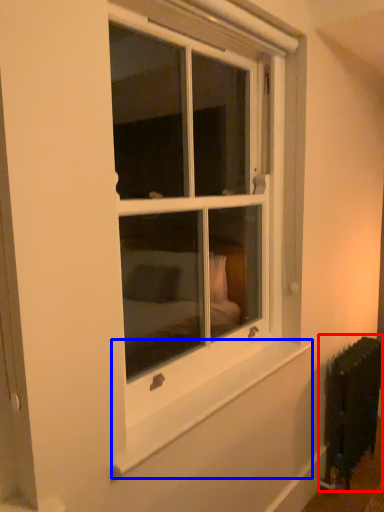
Question: Which object appears closest to the camera in this image, radiator (highlighted by a red box) or window sill (highlighted by a blue box)?

Choices:
 (A) radiator
 (B) window sill

Answer: (B)